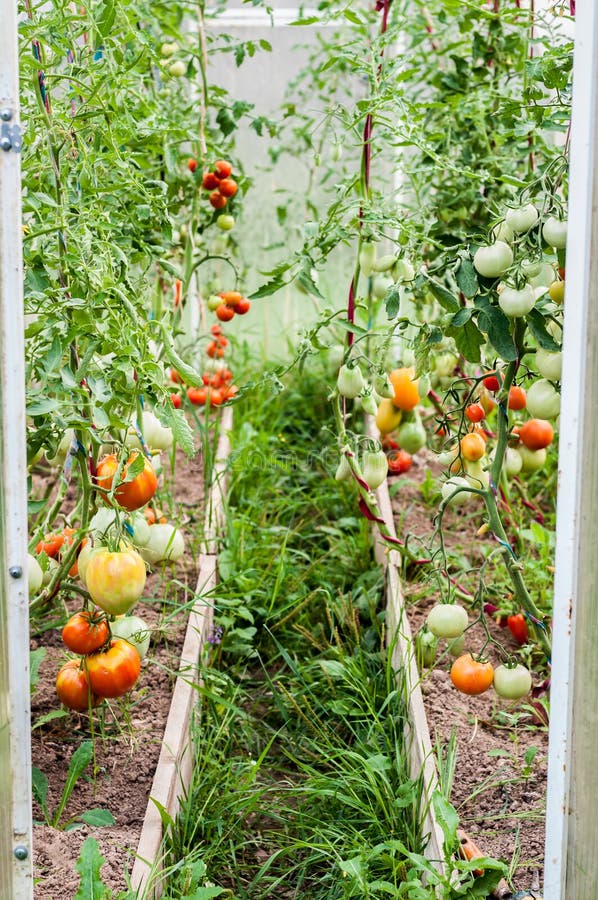
Locate an element on the screen. wooden planter planks is located at coordinates (170, 723), (423, 743), (225, 445), (385, 495).